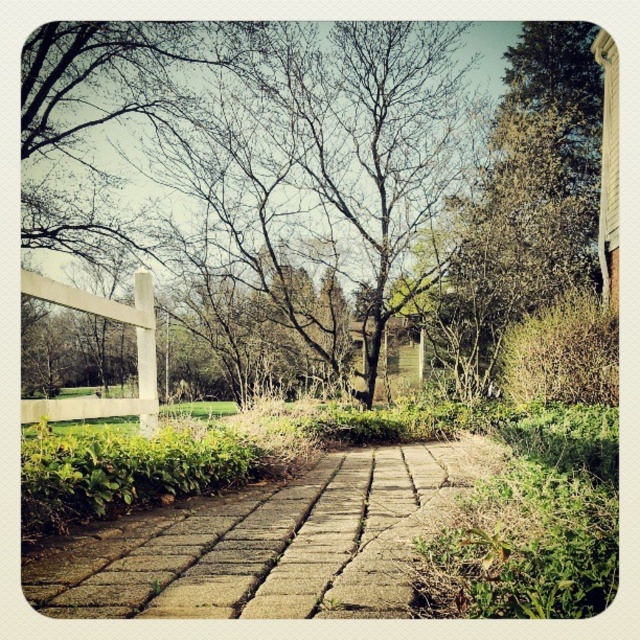
Does brown stone path at center have a greater height compared to white wooden fence at left?

In fact, brown stone path at center may be shorter than white wooden fence at left.

Between point (362, 588) and point (145, 312), which one is positioned in front?

Point (362, 588)

Image resolution: width=640 pixels, height=640 pixels. In order to click on brown stone path at center in this screenshot , I will do `click(272, 544)`.

Between bare branches at center and white wooden fence at left, which one has less height?

white wooden fence at left is shorter.

Is bare branches at center above white wooden fence at left?

Yes.

Is point (310, 134) closer to camera compared to point (145, 417)?

No, (310, 134) is behind (145, 417).

This screenshot has height=640, width=640. I want to click on bare branches at center, so click(381, 177).

Is bare branches at center closer to camera compared to brown stone path at center?

No, bare branches at center is behind brown stone path at center.

Between point (305, 51) and point (48, 605), which one is positioned behind?

The point (305, 51) is more distant.

Does point (464, 74) come behind point (184, 518)?

Yes.

Locate an element on the screen. bare branches at center is located at coordinates (381, 177).